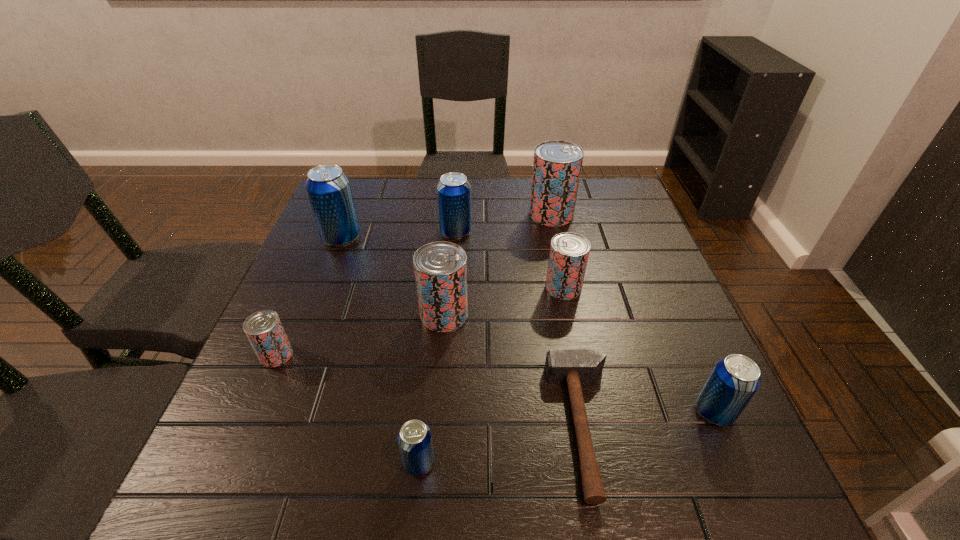
Find the location of a particular element. Image resolution: width=960 pixels, height=540 pixels. free location that satisfies the following two spatial constraints: 1. on the back side of the third smallest red beer can; 2. on the left side of the third smallest blue beer can is located at coordinates (451, 232).

At what (x,y) coordinates should I click in order to perform the action: click on vacant space that satisfies the following two spatial constraints: 1. on the front side of the third biggest red beer can; 2. on the left side of the third smallest blue beer can. Please return your answer as a coordinate pair (x, y). Image resolution: width=960 pixels, height=540 pixels. Looking at the image, I should click on (452, 288).

Identify the location of vacant space that satisfies the following two spatial constraints: 1. on the front side of the biggest blue beer can; 2. on the left side of the third biggest red beer can. The width and height of the screenshot is (960, 540). (323, 288).